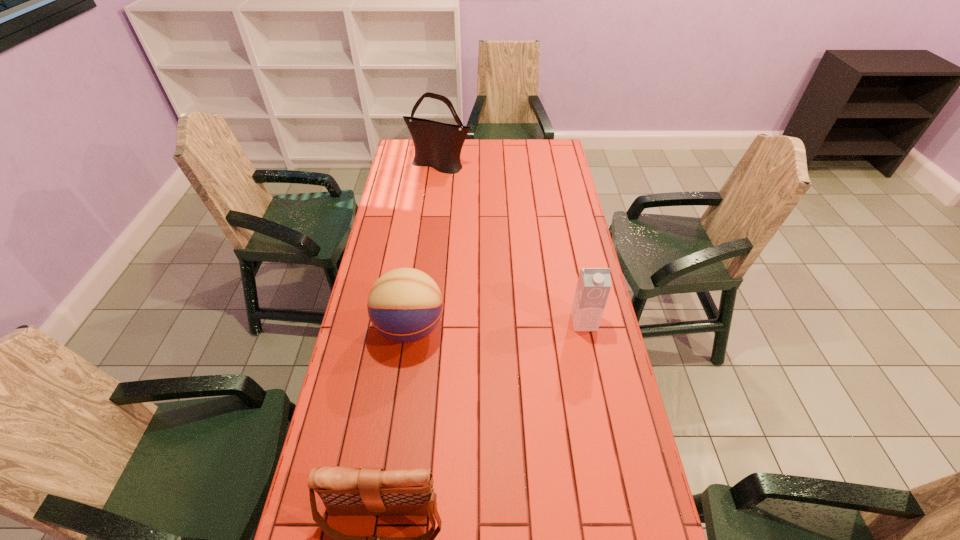
At what (x,y) coordinates should I click in order to perform the action: click on object that is positioned at the right edge. Please return your answer as a coordinate pair (x, y). This screenshot has height=540, width=960. Looking at the image, I should click on tap(594, 284).

Image resolution: width=960 pixels, height=540 pixels. What are the coordinates of `object that is at the far left corner` in the screenshot? It's located at 438,145.

What are the coordinates of `free space at the far edge of the desktop` in the screenshot? It's located at (505, 163).

In the image, there is a desktop. Where is `vacant space at the left edge`? vacant space at the left edge is located at coordinates [394, 263].

Where is `free spot at the right edge of the desktop`? This screenshot has width=960, height=540. free spot at the right edge of the desktop is located at coordinates (544, 196).

This screenshot has height=540, width=960. In order to click on free space between the rightmost object and the taller shoulder bag in this screenshot , I will do `click(512, 244)`.

Identify the location of free space between the basketball and the rightmost object. (497, 325).

The height and width of the screenshot is (540, 960). Find the location of `free area in between the basketball and the carton`. free area in between the basketball and the carton is located at coordinates (497, 325).

The image size is (960, 540). What are the coordinates of `free space between the farthest object and the basketball` in the screenshot? It's located at (424, 247).

Find the location of a particular element. This screenshot has width=960, height=540. free area in between the farthest object and the carton is located at coordinates (512, 244).